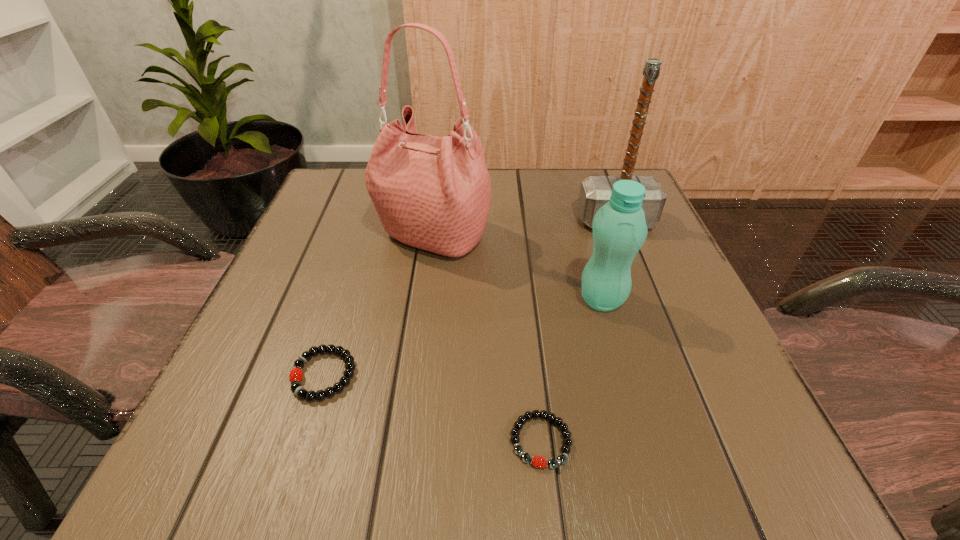
This screenshot has height=540, width=960. Find the location of `vacant space located 0.190m on the front of the third farthest object`. vacant space located 0.190m on the front of the third farthest object is located at coordinates (636, 417).

Where is `free space located on the right of the farther bracelet`? This screenshot has height=540, width=960. free space located on the right of the farther bracelet is located at coordinates (549, 375).

At what (x,y) coordinates should I click in order to perform the action: click on free point located on the back of the nearer bracelet. Please return your answer as a coordinate pair (x, y). The image size is (960, 540). Looking at the image, I should click on (527, 313).

Locate an element on the screen. The image size is (960, 540). handbag that is at the far edge is located at coordinates (432, 193).

Identify the location of hammer located in the far edge section of the desktop. The height and width of the screenshot is (540, 960). (595, 191).

Image resolution: width=960 pixels, height=540 pixels. I want to click on object that is at the near edge, so click(x=536, y=461).

This screenshot has height=540, width=960. Find the location of `object that is at the left edge`. object that is at the left edge is located at coordinates (295, 376).

Identify the location of hammer at the right edge. (595, 191).

At what (x,y) coordinates should I click in order to perform the action: click on bottle at the right edge. Please return your answer as a coordinate pair (x, y). The height and width of the screenshot is (540, 960). Looking at the image, I should click on (619, 227).

Identify the location of object at the far right corner. This screenshot has height=540, width=960. (595, 191).